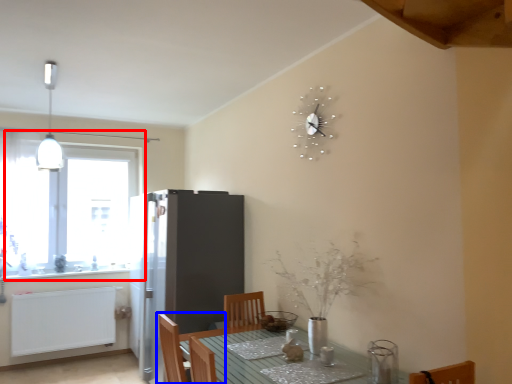
Question: Which of the following is the farthest to the observer, window (highlighted by a red box) or chair (highlighted by a blue box)?

Choices:
 (A) window
 (B) chair

Answer: (A)